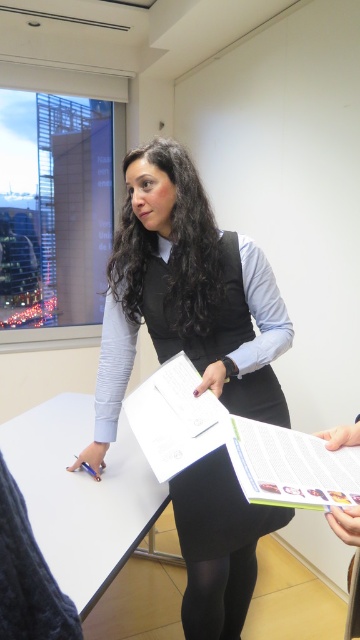
You are an office assistant who needs to place a 1.2 meter tall plant next to the matte black vest at center and the white matte table at center. Based on their heights, which object should the plant be placed closer to?

The matte black vest at center is taller than the white matte table at center. Since the plant is 1.2 meters tall, it should be placed closer to the white matte table at center to maintain visual balance between the objects.

You are organizing a small event and need to place a 2.5 feet wide decorative board between the matte black vest at center and the white matte table at center. Can the board fit between them based on their widths?

The matte black vest at center is wider than the white matte table at center. Therefore, the 2.5 feet wide decorative board may not fit between them if the space between the two objects is narrower than the board. However, since the exact distance isn not provided, we can only compare their widths. The vest is wider, but the table might still have enough space depending on their arrangement.